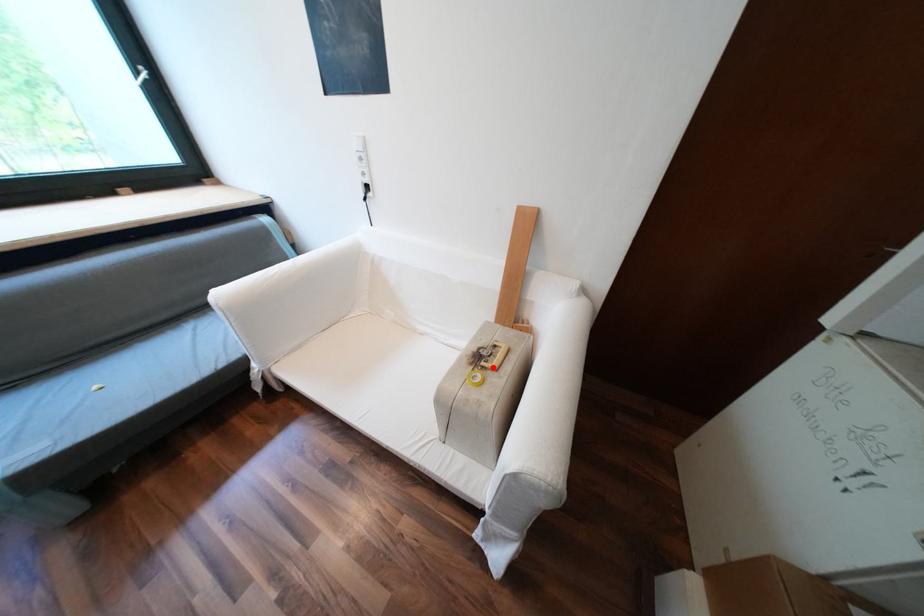
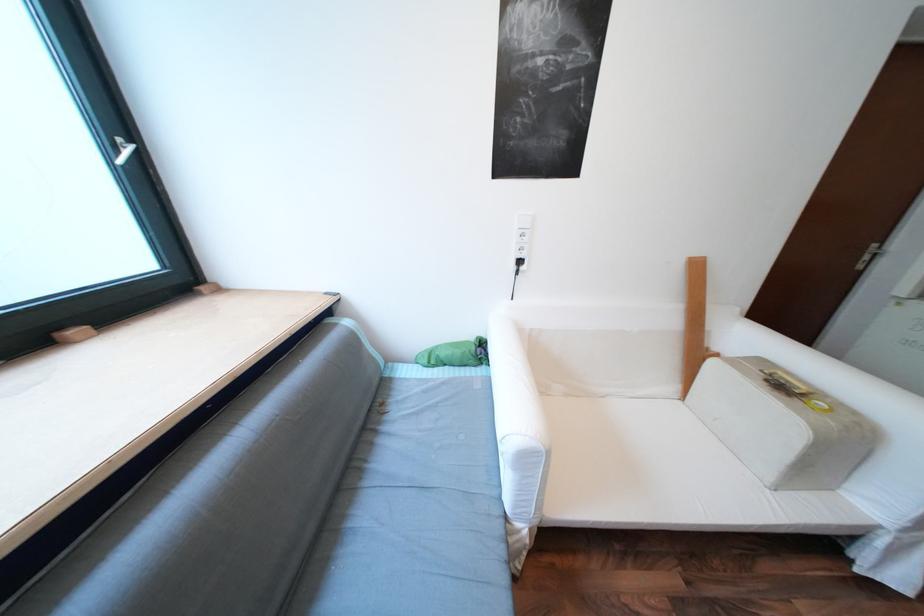
The point at the highlighted location is marked in the first image. Where is the corresponding point in the second image?

(811, 394)